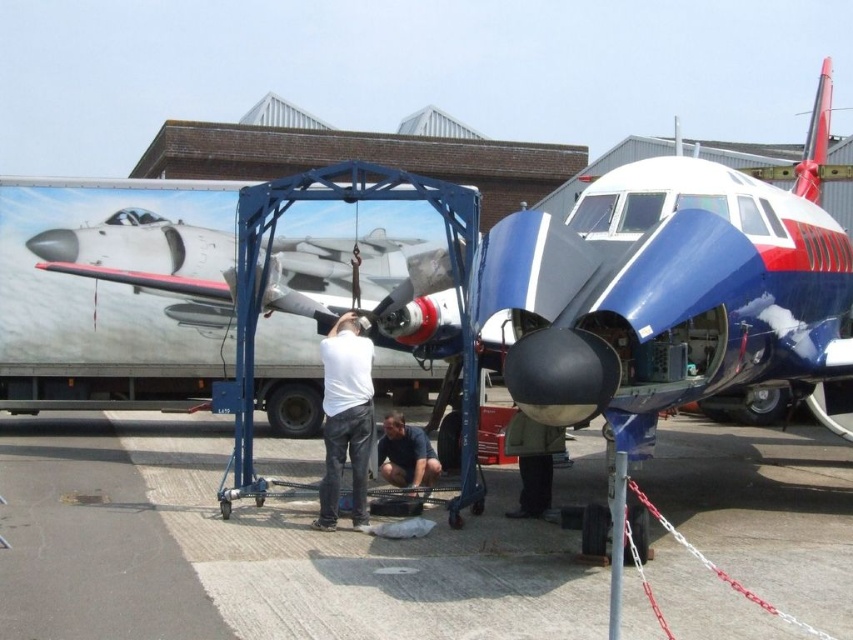
Please describe the object located at point [251,550] in the scene.

The gray asphalt at center is located at point [251,550].

In the scene shown: You are a technician standing on the gray asphalt at center. You need to move to the white matte shirt at center to discuss the aircraft maintenance. Can you walk directly to the shirt without stepping around any obstacles?

The gray asphalt at center might be wider than white matte shirt at center, so there might be enough space to walk directly to the shirt without needing to go around.

You are a safety inspector at the airport. You need to ensure that workers are maintaining a safe distance of at least 2 meters apart for safety protocols. Are the workers wearing white matte shirt at center and dark green jacket at center complying with this requirement?

The distance between the white matte shirt at center and dark green jacket at center is 1.75 meters, which is less than the required 2 meters. Therefore, they are not complying with the safety protocols.